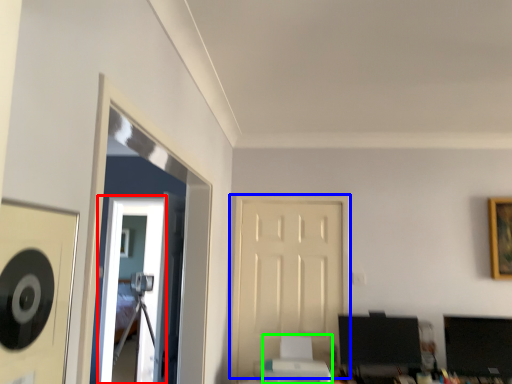
Question: Considering the real-world distances, which object is closest to glass door (highlighted by a red box)? door (highlighted by a blue box) or printer (highlighted by a green box).

Choices:
 (A) door
 (B) printer

Answer: (A)